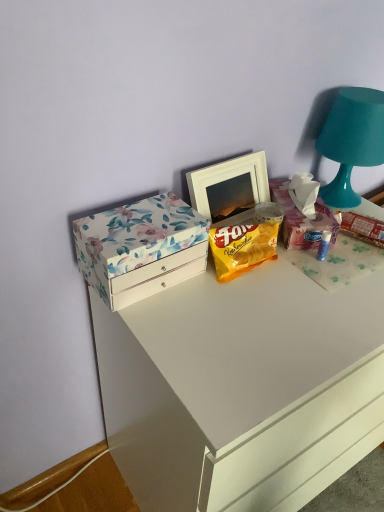
This screenshot has width=384, height=512. I want to click on blank space above floral paper box at left (from a real-world perspective), so click(144, 219).